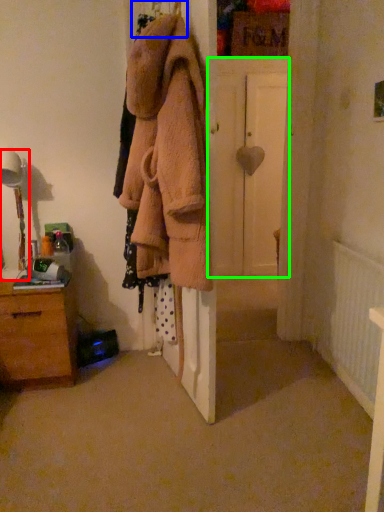
Question: Considering the real-world distances, which object is closest to table lamp (highlighted by a red box)? hanger (highlighted by a blue box) or door (highlighted by a green box).

Choices:
 (A) hanger
 (B) door

Answer: (A)